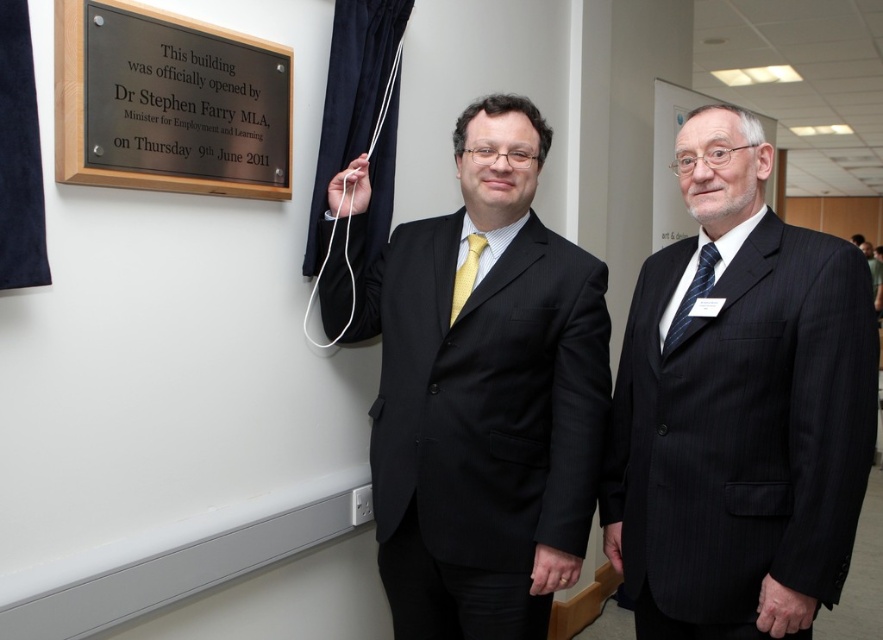
Question: Which point appears farthest from the camera in this image?

Choices:
 (A) (796, 632)
 (B) (499, 324)
 (C) (235, 148)
 (D) (703, 256)

Answer: (C)

Question: Does black pinstripe suit at center appear under yellow silk tie at center?

Choices:
 (A) no
 (B) yes

Answer: (B)

Question: Considering the real-world distances, which object is closest to the yellow silk tie at center?

Choices:
 (A) dark pinstripe suit at right
 (B) black polished plaque at upper left
 (C) blue striped tie at right
 (D) black pinstripe suit at center

Answer: (D)

Question: Is dark pinstripe suit at right to the right of blue striped tie at right from the viewer's perspective?

Choices:
 (A) no
 (B) yes

Answer: (B)

Question: Is dark pinstripe suit at right below blue striped tie at right?

Choices:
 (A) yes
 (B) no

Answer: (A)

Question: Based on their relative distances, which object is nearer to the black polished plaque at upper left?

Choices:
 (A) blue striped tie at right
 (B) yellow silk tie at center

Answer: (B)